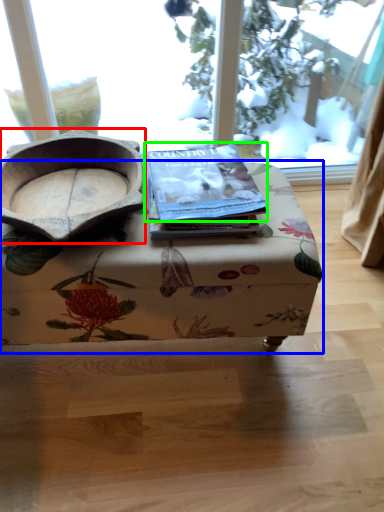
Question: Considering the real-world distances, which object is closest to bowl (highlighted by a red box)? table (highlighted by a blue box) or paperback book (highlighted by a green box).

Choices:
 (A) table
 (B) paperback book

Answer: (B)